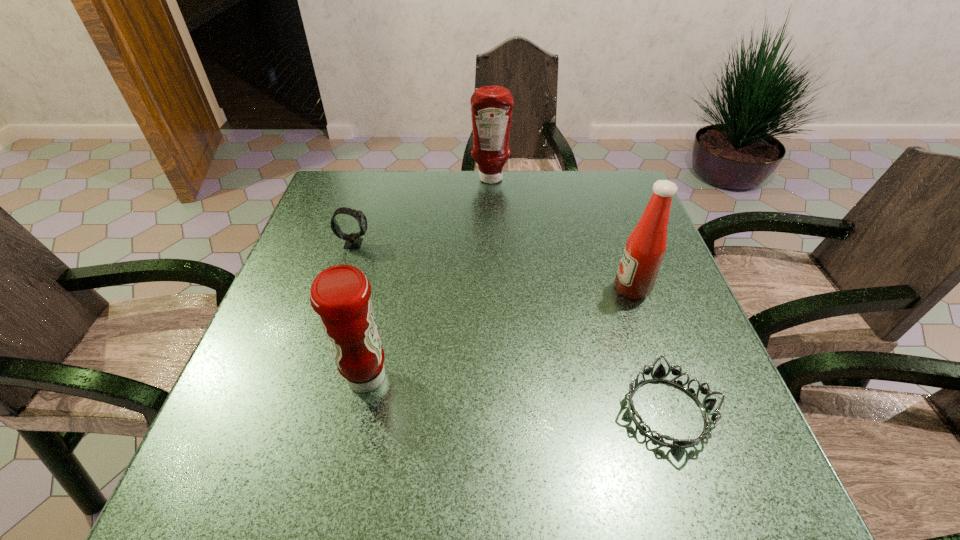
Identify the location of the third object from right to left. (491, 106).

Locate an element on the screen. The width and height of the screenshot is (960, 540). the second condiment from right to left is located at coordinates point(491,106).

At what (x,y) coordinates should I click in order to perform the action: click on the second farthest condiment. Please return your answer as a coordinate pair (x, y). Looking at the image, I should click on (645, 248).

Image resolution: width=960 pixels, height=540 pixels. I want to click on the rightmost condiment, so click(x=645, y=248).

Where is `the leftmost condiment`? the leftmost condiment is located at coordinates (340, 295).

Find the location of a particular element. This screenshot has height=540, width=960. the second object from left to right is located at coordinates (340, 295).

Find the location of a particular element. the fourth nearest object is located at coordinates (353, 241).

At what (x,y) coordinates should I click in order to perform the action: click on the second shortest object. Please return your answer as a coordinate pair (x, y). The width and height of the screenshot is (960, 540). Looking at the image, I should click on (353, 241).

I want to click on the shortest object, so click(707, 405).

This screenshot has height=540, width=960. What are the coordinates of `free space located 0.170m on the left of the second condiment from right to left` in the screenshot? It's located at (416, 179).